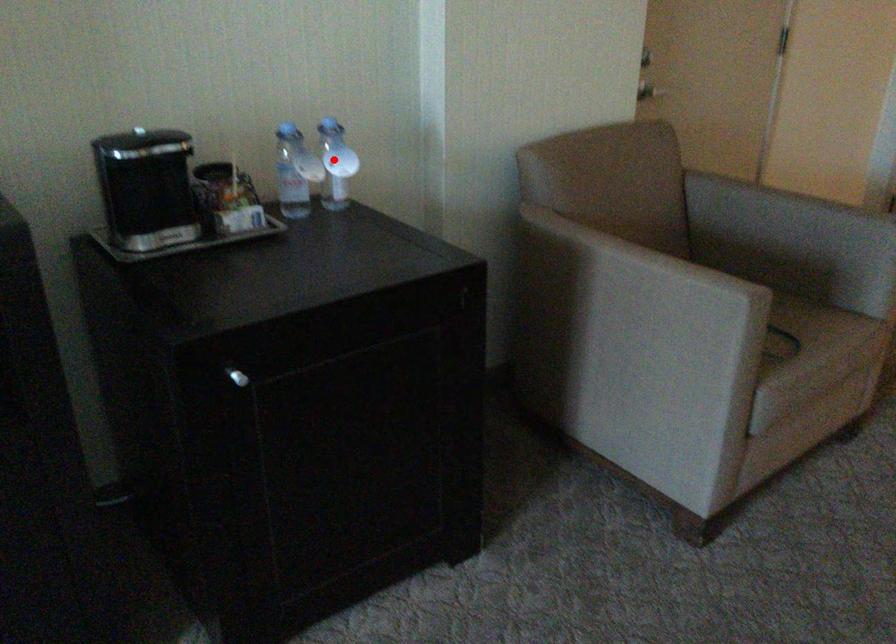
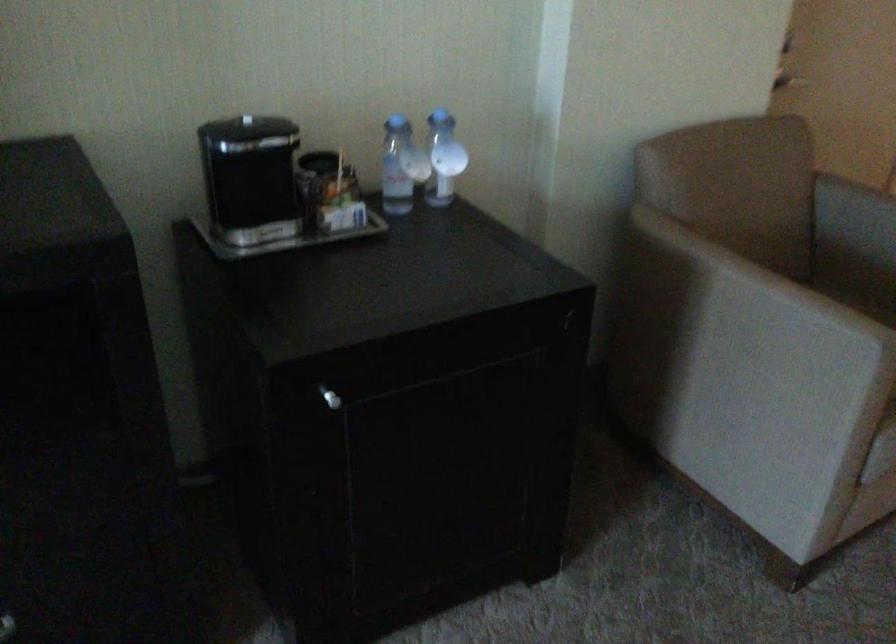
In the second image, find the point that corresponds to the highlighted location in the first image.

(443, 158)